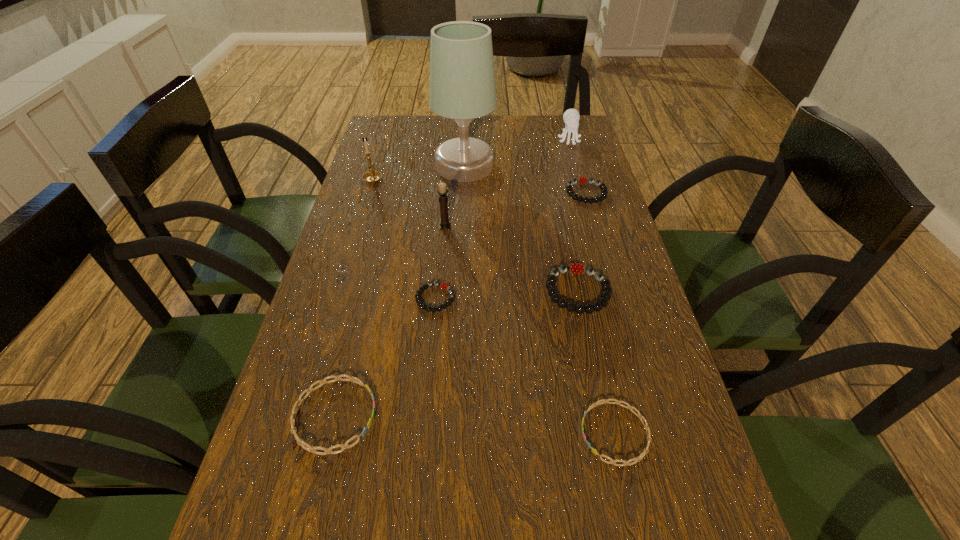
This screenshot has height=540, width=960. Find the location of `the leftmost bracelet`. the leftmost bracelet is located at coordinates (312, 449).

Identify the location of the left blue bracelet. The height and width of the screenshot is (540, 960). (312, 449).

You are a GUI agent. You are given a task and a screenshot of the screen. Output one action in this format:
    pyautogui.click(x=<x>, y=<y>)
    Task: Click on the farthest black bracelet
    
    Given the screenshot: What is the action you would take?
    pyautogui.click(x=604, y=190)

The image size is (960, 540). I want to click on the second smallest black bracelet, so click(x=604, y=190).

The height and width of the screenshot is (540, 960). I want to click on the smaller blue bracelet, so click(646, 450).

Where is `the fourth bracelet from right to left`? Image resolution: width=960 pixels, height=540 pixels. the fourth bracelet from right to left is located at coordinates (443, 285).

Locate an element on the screen. This screenshot has width=960, height=540. the smallest black bracelet is located at coordinates (443, 285).

At what (x,y) coordinates should I click in order to perform the action: click on vacant space located on the base of the lampshade. Please return your answer as a coordinate pair (x, y). The image size is (960, 540). Looking at the image, I should click on (575, 166).

What are the coordinates of `vacant area situated on the handle side of the gold candle holder` in the screenshot? It's located at (390, 122).

Image resolution: width=960 pixels, height=540 pixels. What are the coordinates of `vacant point located on the handle side of the gold candle holder` in the screenshot? It's located at (378, 160).